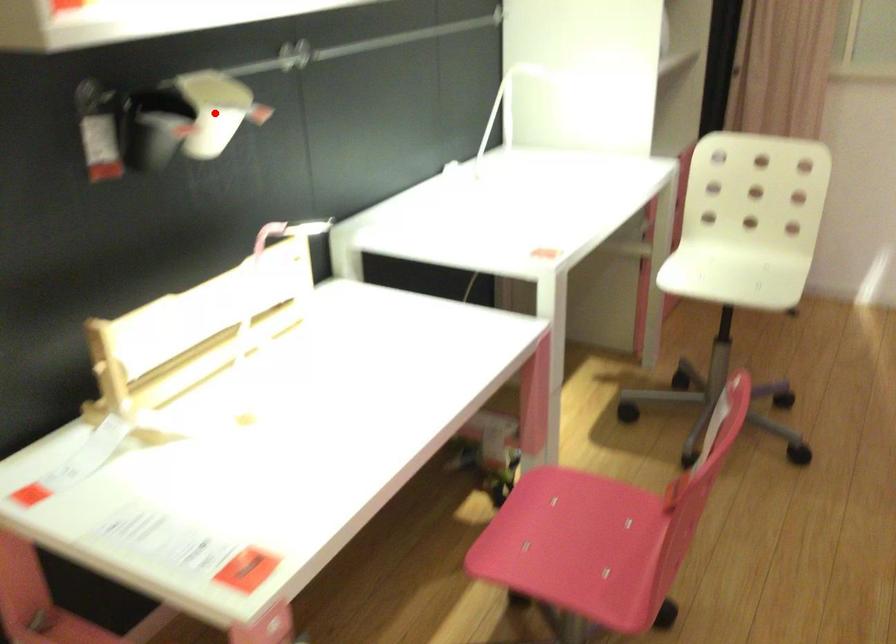
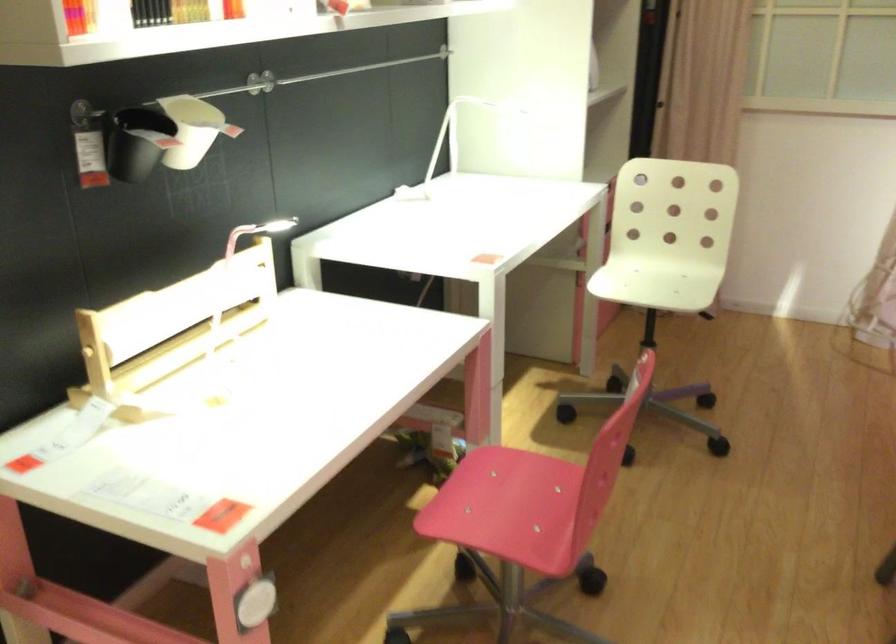
In the second image, find the point that corresponds to the highlighted location in the first image.

(193, 129)